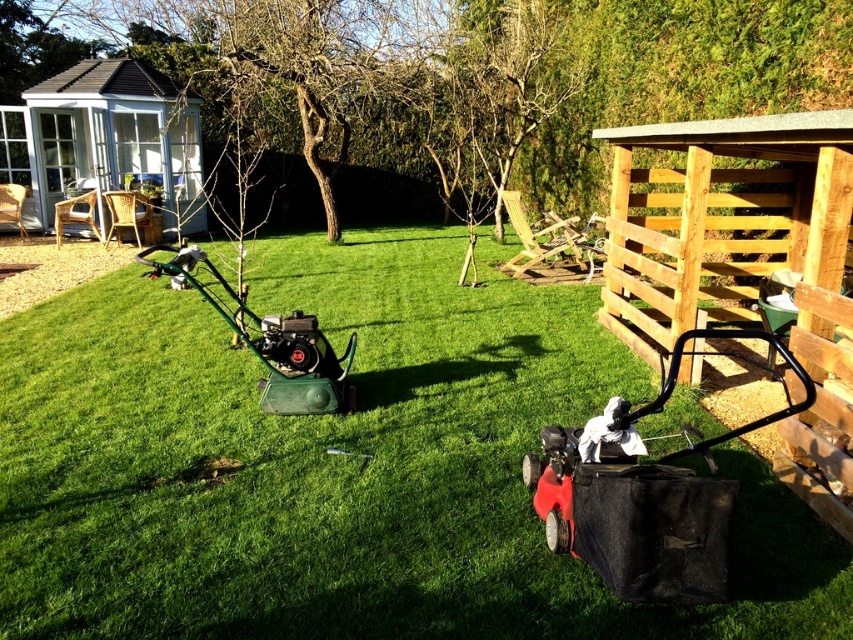
You are standing at point A, which is located at coordinates (341,465). What object is directly under your feet?

The green grass at center is located at point (341,465), so the object directly under your feet is the green grass at center.

You are standing in the backyard and want to place a new garden bench. The bench requires a clear area of 2 meters by 2 meters. Given the current layout with the green grass at center and the white wooden hut at upper left, is there enough space to place the bench without it being under the hut?

The green grass at center is positioned under the white wooden hut at upper left, so placing the bench there would place it under the hut. Therefore, you should look for another area in the backyard that is not under the hut to ensure the bench has a clear 2x2 meter space.

You are standing in the backyard and want to move from the white wooden hut at upper left to the green grass at center. Which direction should you move in?

You should move to the right to reach the green grass at center from the white wooden hut at upper left because the green grass at center is positioned on the right side of the white wooden hut at upper left.